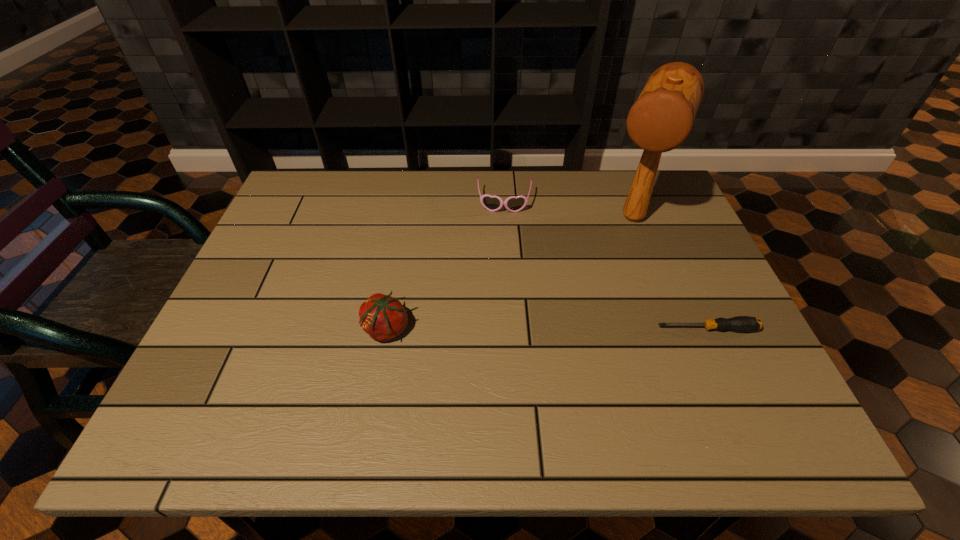
Locate an element on the screen. The height and width of the screenshot is (540, 960). empty space that is in between the second shortest object and the screwdriver is located at coordinates (606, 266).

You are a GUI agent. You are given a task and a screenshot of the screen. Output one action in this format:
    pyautogui.click(x=<x>, y=<y>)
    Task: Click on the vacant space in between the third tallest object and the tallest object
    This screenshot has width=960, height=540.
    Given the screenshot: What is the action you would take?
    pyautogui.click(x=568, y=211)

Identify the location of free point between the second object from left to right and the leftmost object. This screenshot has width=960, height=540. (445, 266).

Where is `empty space between the second object from left to right and the screwdriver`? The image size is (960, 540). empty space between the second object from left to right and the screwdriver is located at coordinates (606, 266).

Locate an element on the screen. empty space between the shortest object and the leftmost object is located at coordinates (546, 329).

Where is `object that stands as the second closest to the mallet`? object that stands as the second closest to the mallet is located at coordinates (739, 323).

Where is `object that is the closest one to the third shortest object`? object that is the closest one to the third shortest object is located at coordinates (492, 203).

This screenshot has width=960, height=540. I want to click on vacant space that satisfies the following two spatial constraints: 1. on the front side of the sunglasses; 2. at the tip of the shortest object, so click(513, 329).